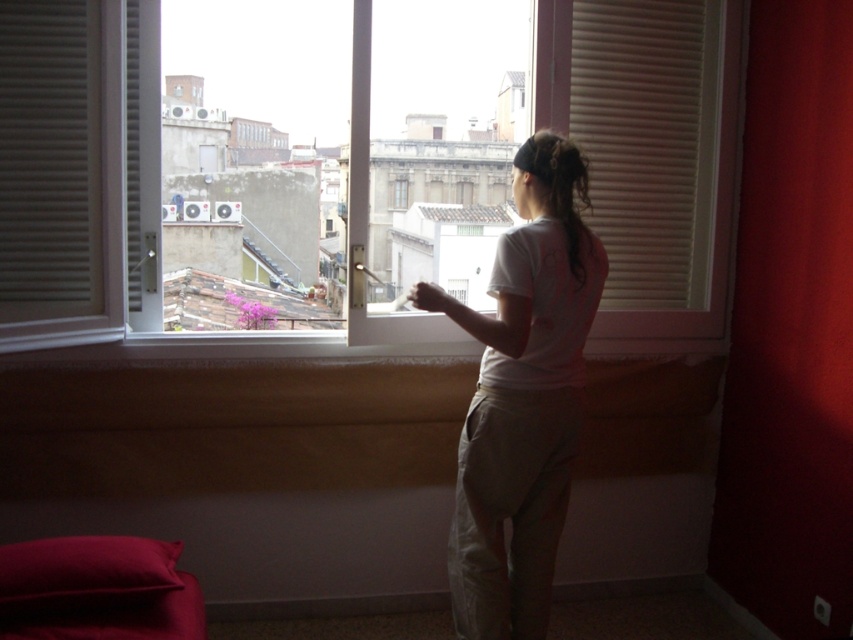
Question: From the image, what is the correct spatial relationship of white plastic window at center in relation to white cotton shirt at center?

Choices:
 (A) left
 (B) right

Answer: (A)

Question: Is red velvet curtain at center closer to the viewer compared to white cotton shirt at center?

Choices:
 (A) no
 (B) yes

Answer: (A)

Question: Which point appears farthest from the camera in this image?

Choices:
 (A) (7, 205)
 (B) (578, 29)
 (C) (564, 177)

Answer: (B)

Question: Which point is closer to the camera?

Choices:
 (A) red velvet curtain at center
 (B) white plastic window at center
 (C) matte white blinds at left
 (D) beige matte blinds at right

Answer: (B)

Question: Can you confirm if white plastic window at center is smaller than white cotton shirt at center?

Choices:
 (A) yes
 (B) no

Answer: (B)

Question: Which of these objects is positioned closest to the dark brown hair at upper center?

Choices:
 (A) matte white blinds at left
 (B) white plastic window at center

Answer: (A)